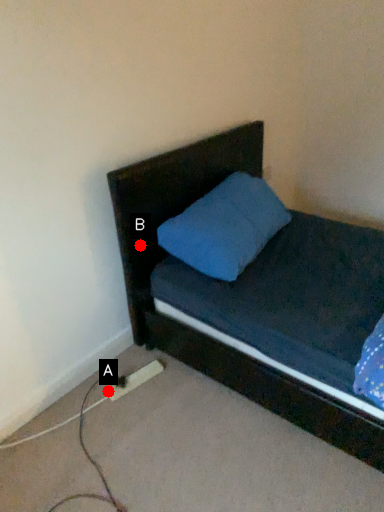
Question: Two points are circled on the image, labeled by A and B beside each circle. Which point is closer to the camera taking this photo?

Choices:
 (A) A is closer
 (B) B is closer

Answer: (B)